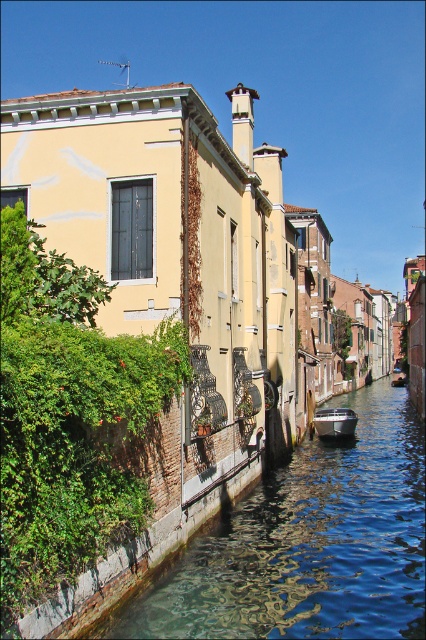
Does point (256, 496) lie behind point (333, 426)?

No, (256, 496) is closer to viewer.

Can you confirm if smooth concrete canal at center is positioned to the left of metallic gray boat at lower center?

Correct, you'll find smooth concrete canal at center to the left of metallic gray boat at lower center.

Locate an element on the screen. smooth concrete canal at center is located at coordinates (307, 544).